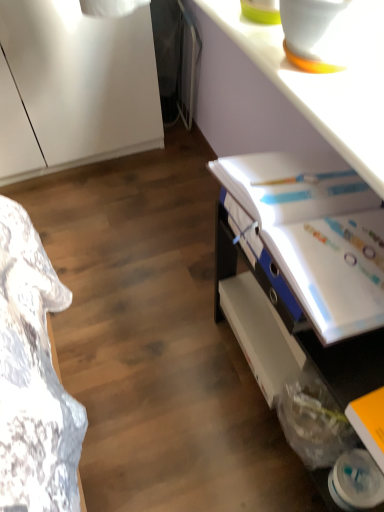
Where is `free spot to the left of white glossy desk at lower right`? The width and height of the screenshot is (384, 512). free spot to the left of white glossy desk at lower right is located at coordinates (167, 392).